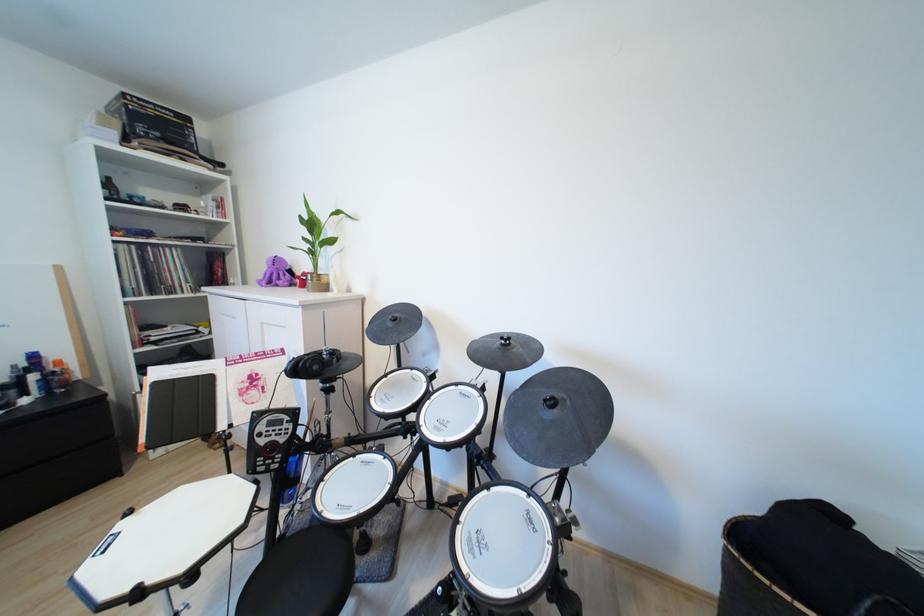
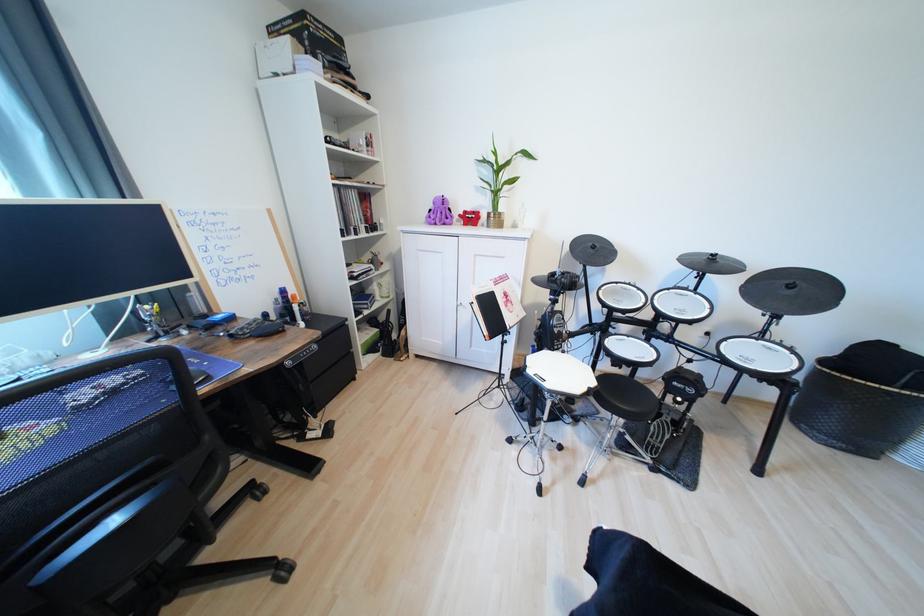
Where in the second image is the point corresponding to pixel 289 277 from the first image?

(447, 216)